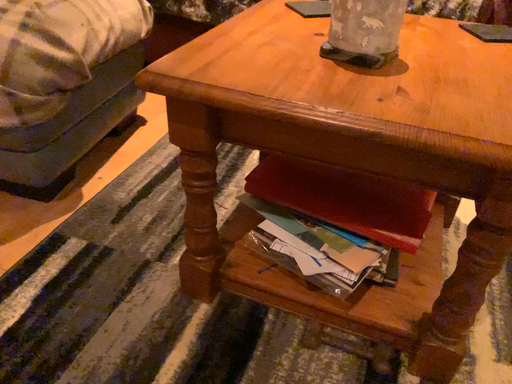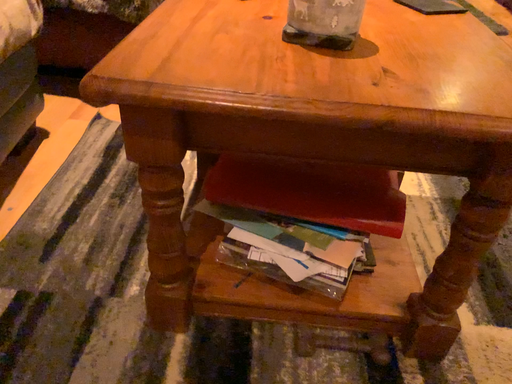
Question: How did the camera likely rotate when shooting the video?

Choices:
 (A) rotated left
 (B) rotated right

Answer: (B)